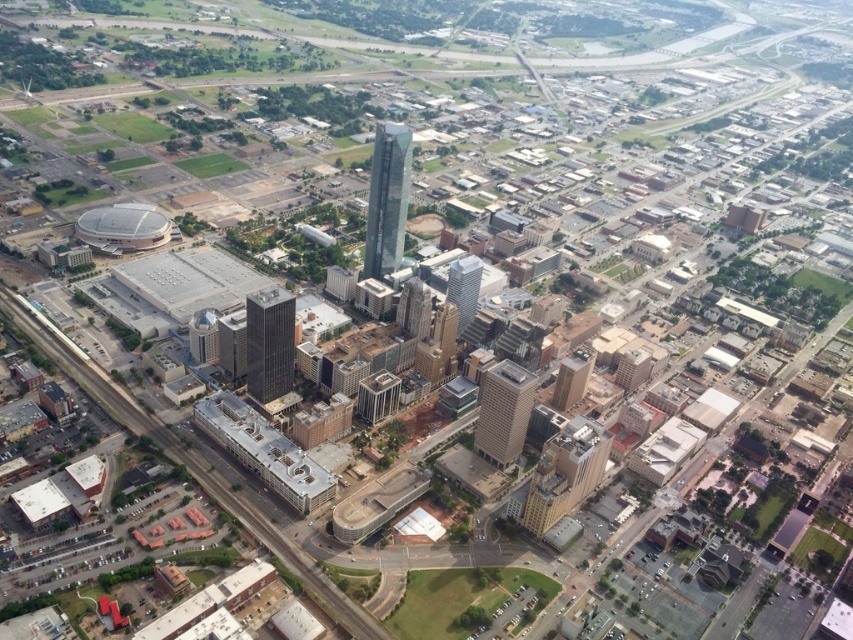
Question: Does dark gray glass skyscraper at center appear on the right side of gray concrete skyscraper at center?

Choices:
 (A) no
 (B) yes

Answer: (A)

Question: Which of the following is the closest to the observer?

Choices:
 (A) (379, 276)
 (B) (251, 301)

Answer: (B)

Question: Which point is farther to the camera?

Choices:
 (A) (372, 218)
 (B) (477, 282)

Answer: (A)

Question: Which object appears closest to the camera in this image?

Choices:
 (A) glassy silver skyscraper at center
 (B) dark gray glass skyscraper at center
 (C) gray concrete skyscraper at center

Answer: (C)

Question: Is shiny glass skyscraper at center thinner than gray concrete skyscraper at center?

Choices:
 (A) yes
 (B) no

Answer: (A)

Question: Can you confirm if dark gray glass skyscraper at center is positioned below gray concrete skyscraper at center?

Choices:
 (A) yes
 (B) no

Answer: (B)